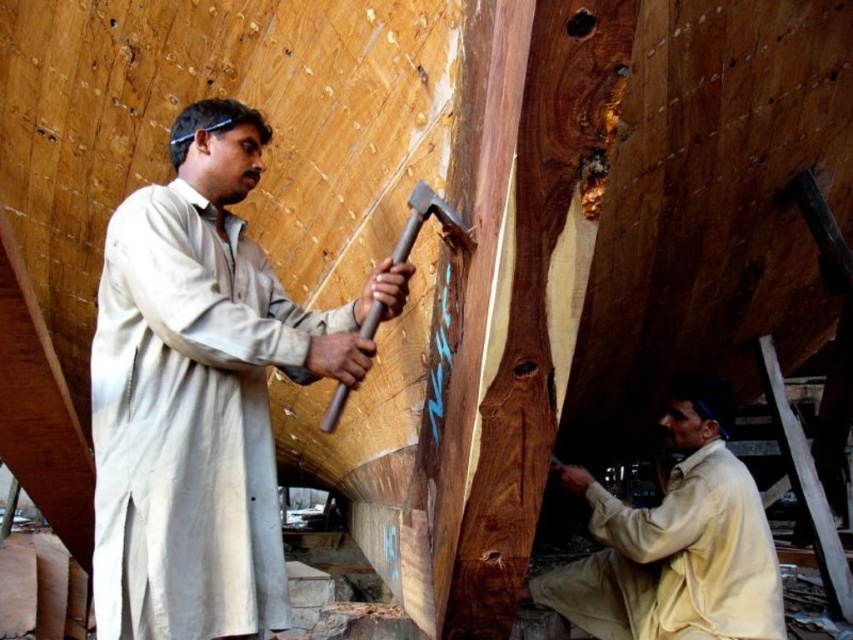
You are standing in the shipyard and need to locate the light beige fabric shirt at left. According to the coordinates provided, where should you look relative to the center of the image?

The light beige fabric shirt at left is located at point coordinates 0.614 on the x axis and 0.237 on the y axis, so you should look to the right and slightly below the center of the image.

You are a safety inspector in the shipyard and need to ensure that the distance between the light beige fabric at lower right and the wooden handle hammer at center is at least 5 feet for safety. Is the current distance compliant with the safety requirement?

The distance between the light beige fabric at lower right and the wooden handle hammer at center is 6.06 feet, which exceeds the required 5 feet, so it is compliant with the safety requirement.

From the picture: You are standing in the shipyard and need to locate the light beige fabric at lower right. According to the coordinates provided, where exactly is it positioned?

The light beige fabric at lower right is located at point (676, 540), which means it is positioned near the lower right corner of the image based on the coordinate system provided.